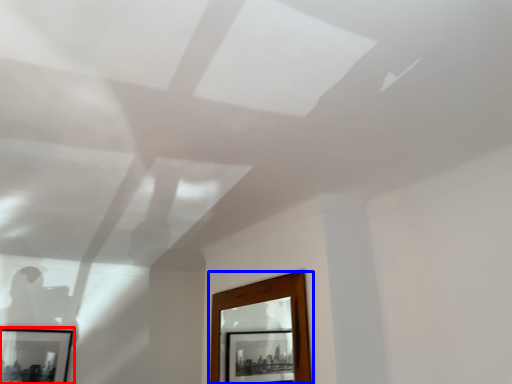
Question: Which point is closer to the camera, picture frame (highlighted by a red box) or window (highlighted by a blue box)?

Choices:
 (A) picture frame
 (B) window

Answer: (B)